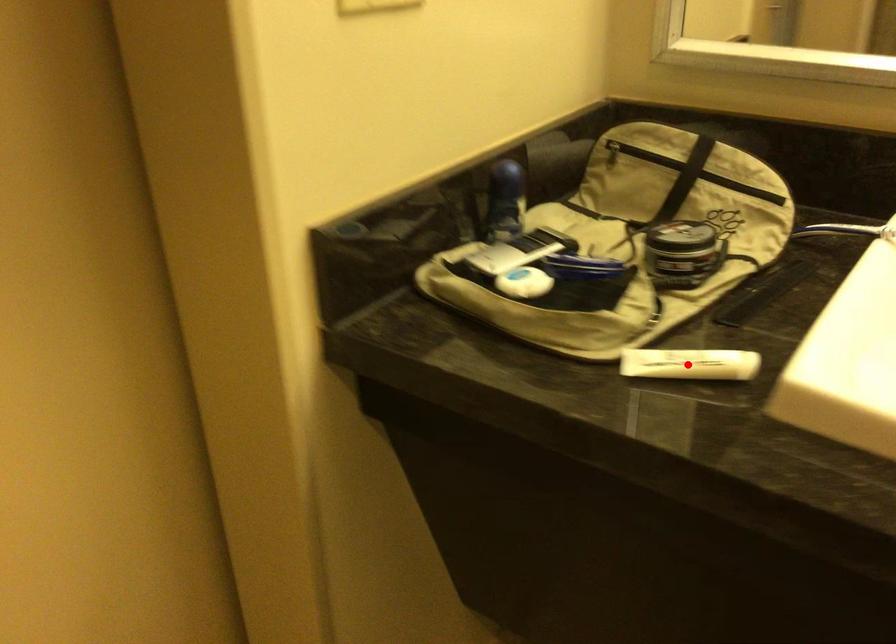
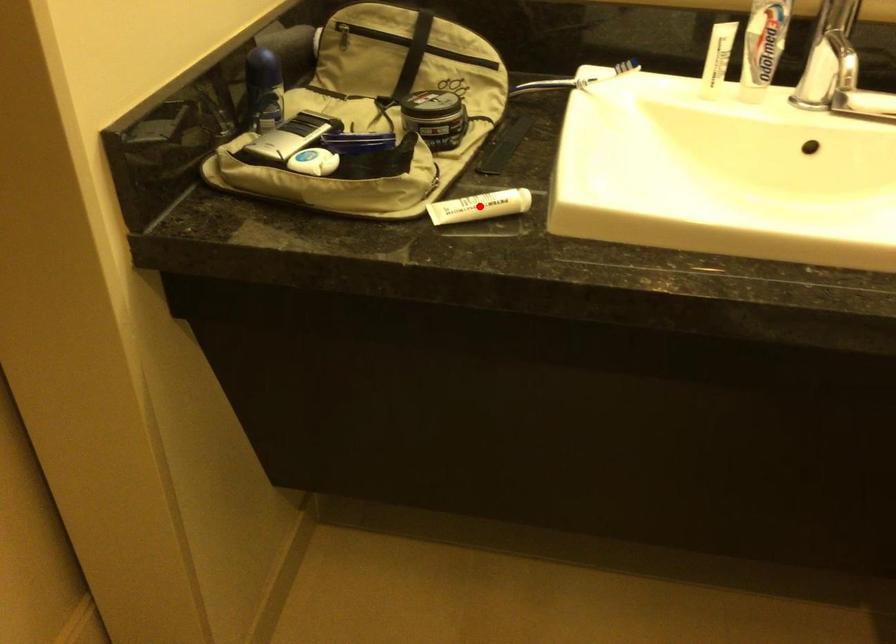
From the picture: I am providing you with two images of the same scene from different viewpoints. A red point is marked on the first image and another point is marked on the second image. Is the marked point in image1 the same physical position as the marked point in image2?

Yes